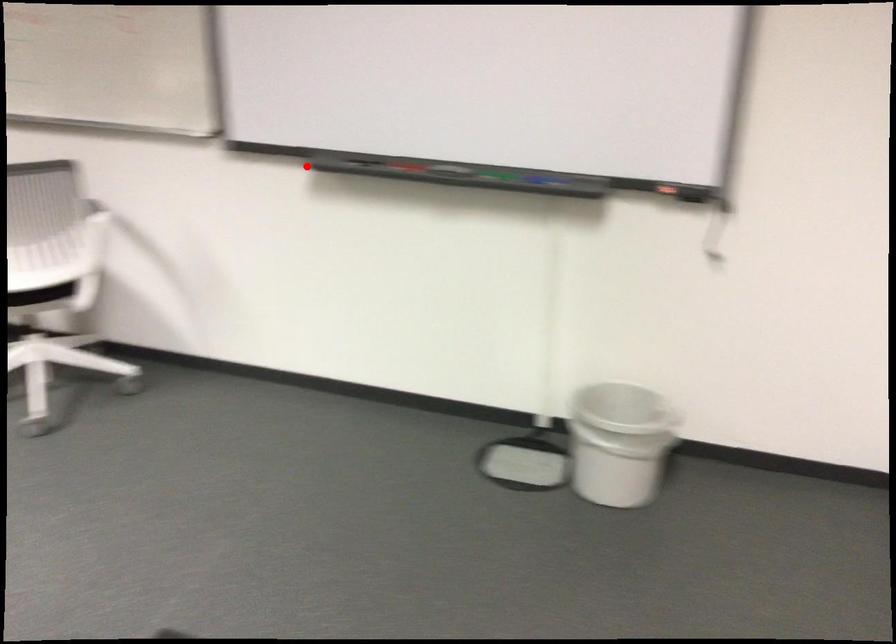
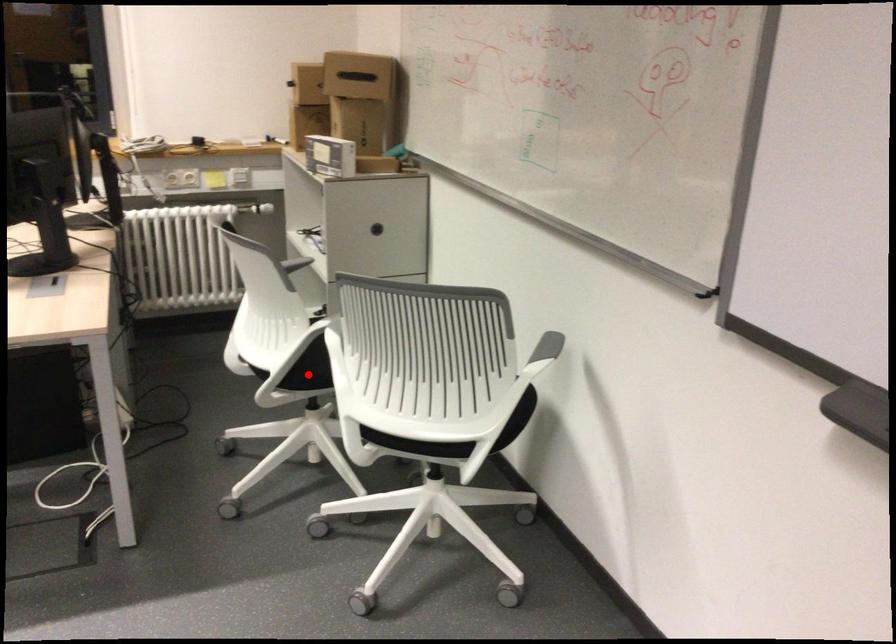
I am providing you with two images of the same scene from different viewpoints. A red point is marked on the first image and another point is marked on the second image. Do the highlighted points in image1 and image2 indicate the same real-world spot?

No